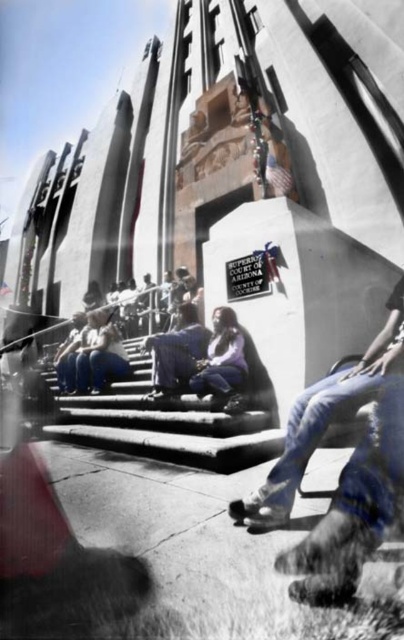
Question: Does denim pants at center have a larger size compared to denim jacket at center?

Choices:
 (A) no
 (B) yes

Answer: (B)

Question: Can you confirm if smooth concrete stairs at center is positioned above denim jacket at center?

Choices:
 (A) no
 (B) yes

Answer: (A)

Question: Which object appears closest to the camera in this image?

Choices:
 (A) denim pants at center
 (B) denim jacket at center
 (C) smooth concrete stairs at center

Answer: (A)

Question: Considering the real-world distances, which object is closest to the smooth concrete stairs at center?

Choices:
 (A) denim pants at center
 (B) denim jacket at center

Answer: (B)

Question: Can you confirm if smooth concrete stairs at center is thinner than denim jacket at center?

Choices:
 (A) yes
 (B) no

Answer: (B)

Question: Which point appears closest to the camera in this image?

Choices:
 (A) (237, 348)
 (B) (383, 333)

Answer: (B)